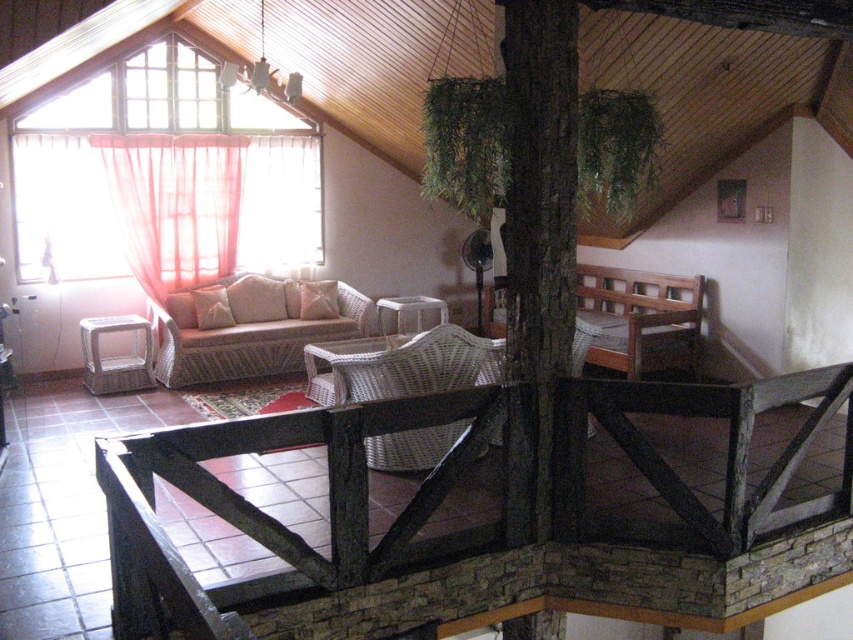
You are standing in the room and want to move from the sheer pink curtain at left to the woven rattan armchair at center. Can you walk directly between them without any obstacles?

The sheer pink curtain at left is positioned over the woven rattan armchair at center, so there is no space to walk directly between them. You would need to move around the curtain or the armchair to reach your destination.

You are standing in the room and want to place a small plant pot between the two points, point (370,467) and point (199,320). Which point should the plant pot be closer to in order to be nearer to the camera?

The plant pot should be closer to point (370,467) because it is nearer to the camera compared to point (199,320).

You are planning to place a new decorative item on the woven beige couch at center and the beige woven pillow at center. Since you want to ensure the item fits well, which object should you choose to place it on, considering their sizes?

The woven beige couch at center is larger in size than the beige woven pillow at center, so you should place the decorative item on the woven beige couch at center to ensure it fits well.